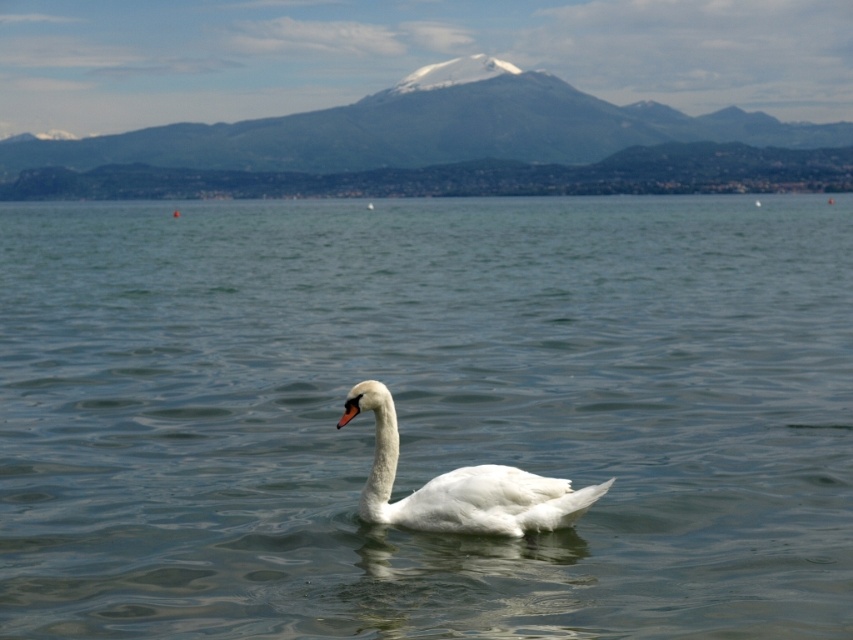
You are an environmental scientist observing the lakeside scene. You notice the clear water at center and the white matte swan at center. Which object appears taller in the image?

The clear water at center appears taller than the white matte swan at center.